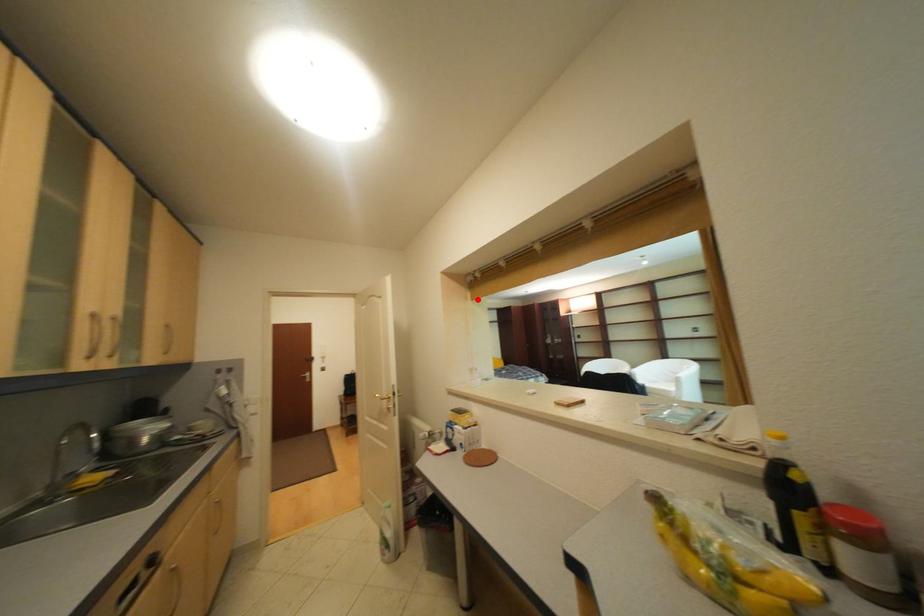
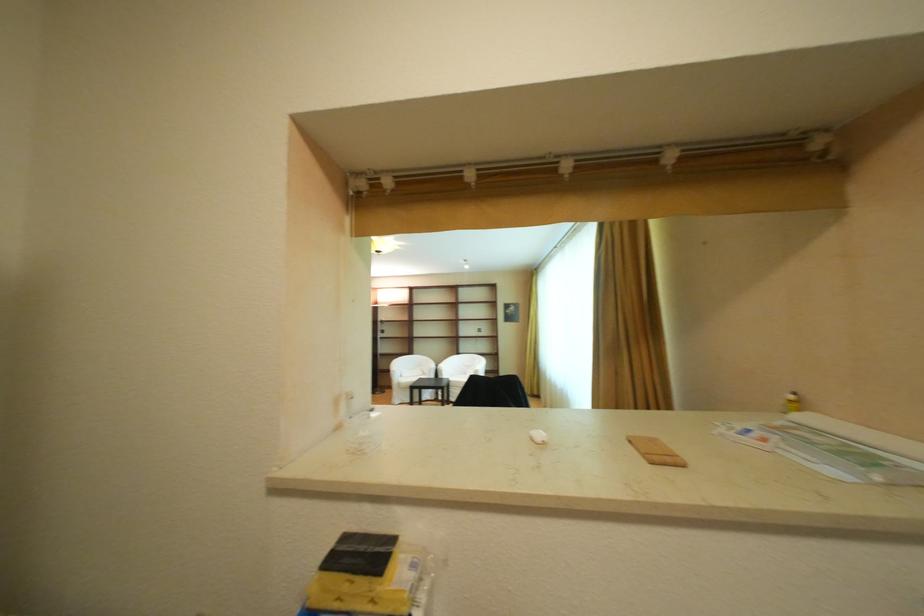
Question: A red point is marked in image1. In image2, is the corresponding 3D point closer to the camera or farther? Reply with the corresponding letter.

Choices:
 (A) The corresponding 3D point is closer.
 (B) The corresponding 3D point is farther.

Answer: (B)